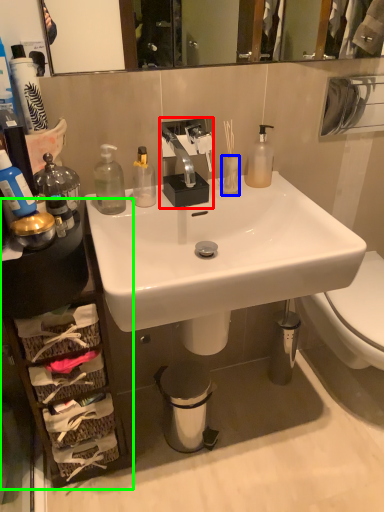
Question: Which object is positioned farthest from sink (highlighted by a red box)? Select from toilet paper (highlighted by a blue box) and cabinetry (highlighted by a green box).

Choices:
 (A) toilet paper
 (B) cabinetry

Answer: (B)